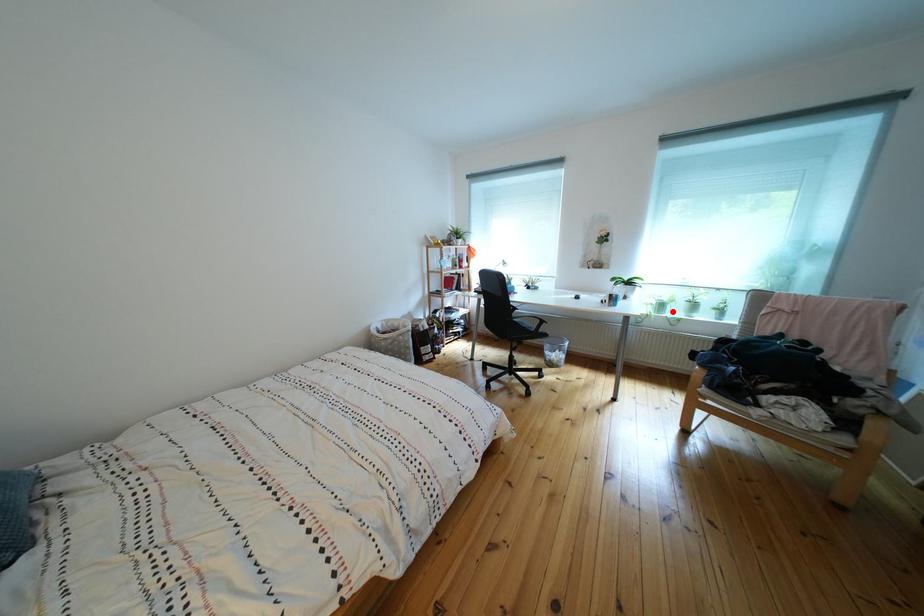
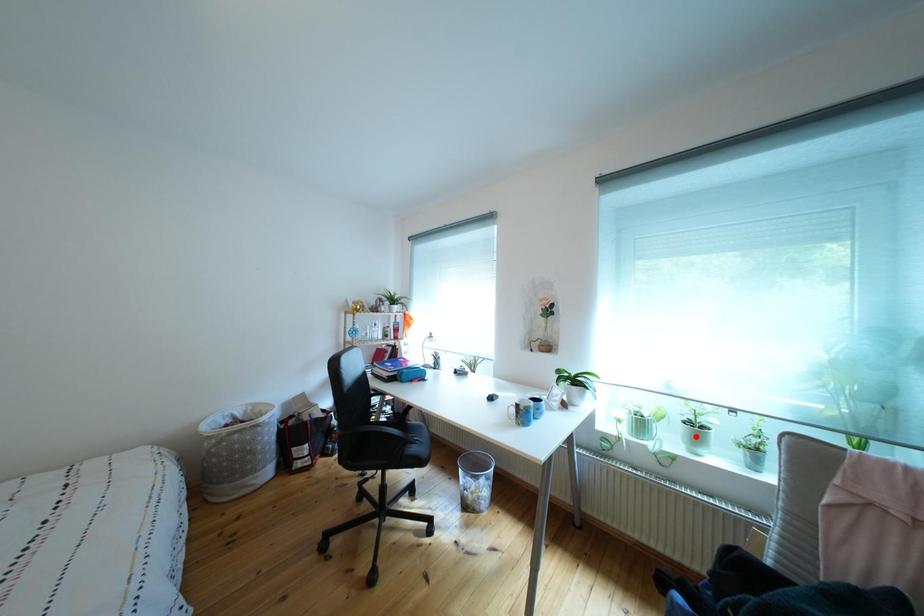
I am providing you with two images of the same scene from different viewpoints. A red point is marked on the first image and another point is marked on the second image. Is the marked point in image1 the same physical position as the marked point in image2?

No